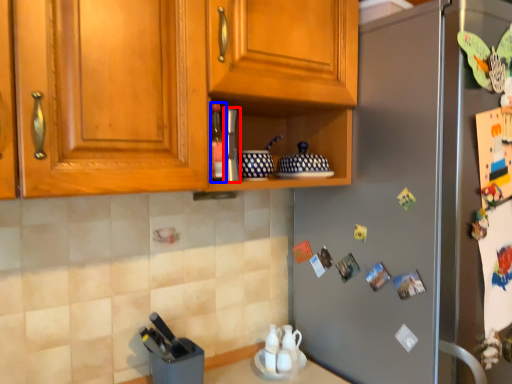
Question: Which point is closer to the camera, appliance (highlighted by a red box) or bottle (highlighted by a blue box)?

Choices:
 (A) appliance
 (B) bottle

Answer: (B)